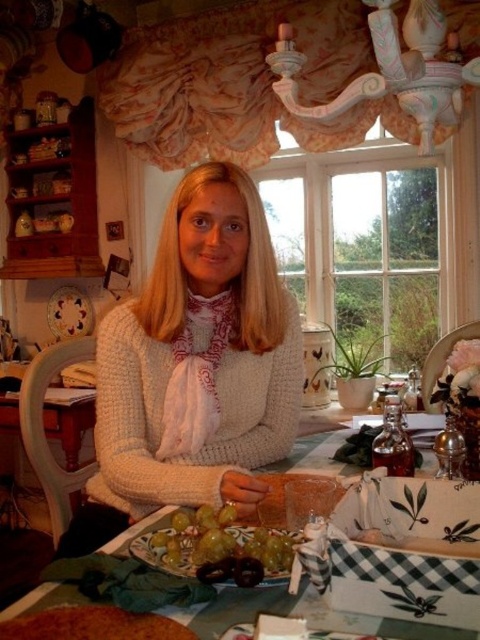
Who is more distant from viewer, (x=228, y=488) or (x=149, y=538)?

The point (x=228, y=488) is more distant.

Who is more forward, (168,248) or (178,566)?

Point (178,566) is more forward.

Find the location of `white knitted sweater at center`. white knitted sweater at center is located at coordinates (199, 358).

Identify the location of green matte grapes at lower center. (217, 541).

Can you confirm if green matte grapes at lower center is positioned to the left of brown crumbly cake at lower left?

No, green matte grapes at lower center is not to the left of brown crumbly cake at lower left.

Between point (257, 557) and point (94, 604), which one is positioned behind?

The point (257, 557) is behind.

Find the location of `green matte grapes at lower center`. green matte grapes at lower center is located at coordinates (217, 541).

Who is positioned more to the right, green matte plate at lower center or brown crumbly cake at lower left?

Positioned to the right is green matte plate at lower center.

Is point (312, 448) more distant than point (132, 632)?

Yes, it is.

The width and height of the screenshot is (480, 640). What do you see at coordinates (300, 616) in the screenshot?
I see `green matte plate at lower center` at bounding box center [300, 616].

At what (x,y) coordinates should I click in order to perform the action: click on green matte plate at lower center. Please return your answer as a coordinate pair (x, y). Looking at the image, I should click on (300, 616).